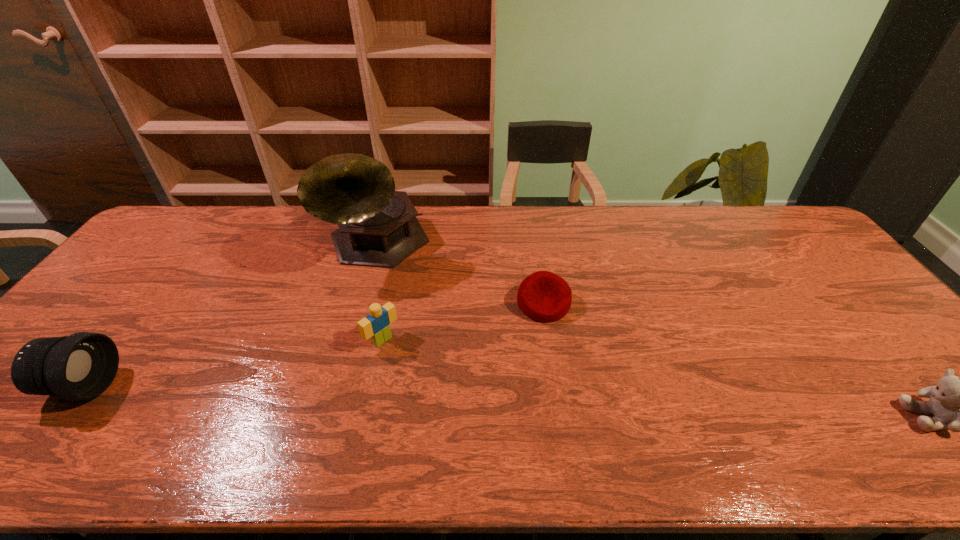
Identify the location of free space on the desktop that is between the telephoto lens and the teddy bear and is positioned on the seat area of the shortest object. This screenshot has height=540, width=960. (579, 403).

Find the location of a particular element. vacant space on the desktop that is between the leftmost object and the teddy bear and is positioned on the face of the third farthest object is located at coordinates (450, 399).

This screenshot has height=540, width=960. What are the coordinates of `vacant space on the desktop that is between the telephoto lens and the teddy bear and is positioned on the horn direction of the phonograph record` in the screenshot? It's located at (444, 399).